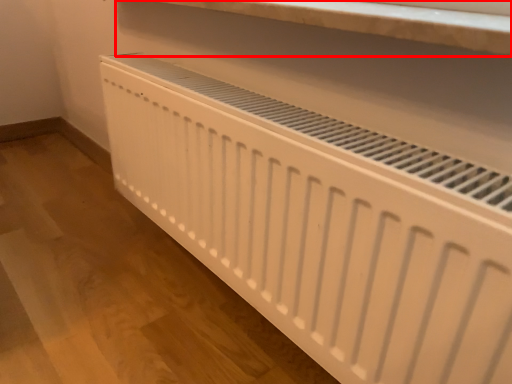
Question: From the image's perspective, what is the correct spatial positioning of shelf (annotated by the red box) in reference to home appliance?

Choices:
 (A) above
 (B) below

Answer: (A)